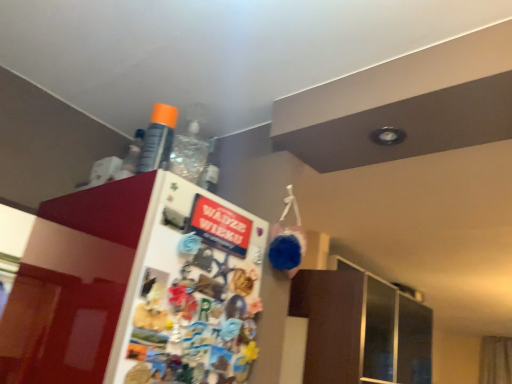
Question: Can you confirm if white glossy fridge at upper left is positioned to the left of orange matte spray can at upper center?

Choices:
 (A) yes
 (B) no

Answer: (B)

Question: Is the position of white glossy fridge at upper left less distant than that of orange matte spray can at upper center?

Choices:
 (A) no
 (B) yes

Answer: (B)

Question: From the image's perspective, would you say white glossy fridge at upper left is shown under orange matte spray can at upper center?

Choices:
 (A) yes
 (B) no

Answer: (A)

Question: Is white glossy fridge at upper left not close to orange matte spray can at upper center?

Choices:
 (A) no
 (B) yes

Answer: (A)

Question: Considering the relative sizes of white glossy fridge at upper left and orange matte spray can at upper center in the image provided, is white glossy fridge at upper left smaller than orange matte spray can at upper center?

Choices:
 (A) yes
 (B) no

Answer: (B)

Question: Is white glossy fridge at upper left facing towards orange matte spray can at upper center?

Choices:
 (A) yes
 (B) no

Answer: (B)

Question: Does orange matte spray can at upper center have a lesser width compared to white glossy fridge at upper left?

Choices:
 (A) yes
 (B) no

Answer: (B)

Question: Is orange matte spray can at upper center positioned in front of white glossy fridge at upper left?

Choices:
 (A) yes
 (B) no

Answer: (B)

Question: Considering the relative sizes of orange matte spray can at upper center and white glossy fridge at upper left in the image provided, is orange matte spray can at upper center smaller than white glossy fridge at upper left?

Choices:
 (A) no
 (B) yes

Answer: (B)

Question: Is orange matte spray can at upper center outside white glossy fridge at upper left?

Choices:
 (A) yes
 (B) no

Answer: (A)

Question: Does orange matte spray can at upper center have a greater width compared to white glossy fridge at upper left?

Choices:
 (A) yes
 (B) no

Answer: (A)

Question: Is orange matte spray can at upper center taller than white glossy fridge at upper left?

Choices:
 (A) yes
 (B) no

Answer: (B)

Question: Considering the positions of white glossy fridge at upper left and orange matte spray can at upper center in the image, is white glossy fridge at upper left wider or thinner than orange matte spray can at upper center?

Choices:
 (A) wide
 (B) thin

Answer: (B)